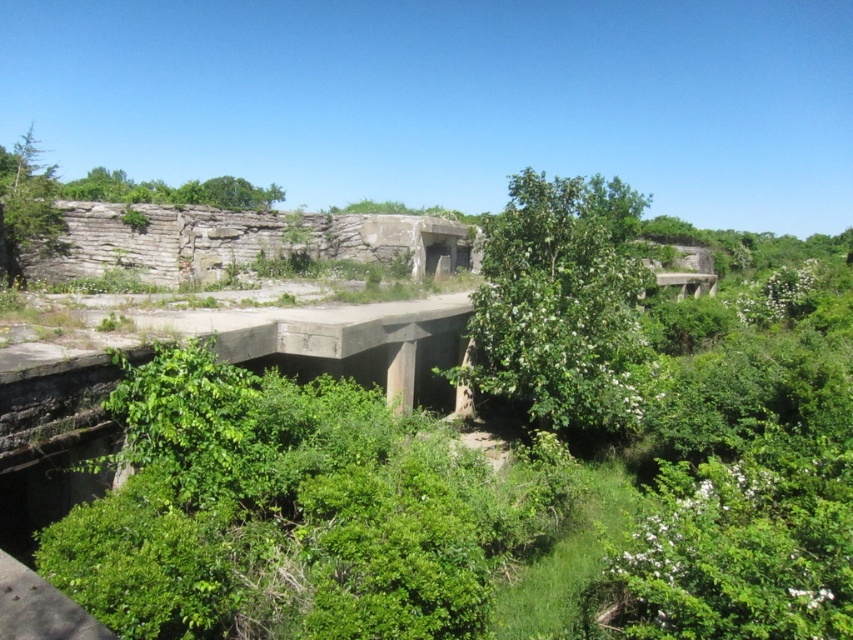
You are standing at the entrance of the abandoned military structure and want to reach a specific point marked as point (561, 221). If your maximum walking distance is 50 feet, can you reach that point without exceeding your limit?

The distance between you and point (561, 221) is 62.19 feet, which exceeds your maximum walking distance of 50 feet. Therefore, you cannot reach the point without exceeding your limit.

You are a hiker who has stumbled upon this abandoned military structure. You notice two green leafy trees in the scene. Which tree is closer to the ground, the green leafy tree at center or the green leafy tree at upper center?

The green leafy tree at center is positioned under the green leafy tree at upper center, so the green leafy tree at center is closer to the ground.